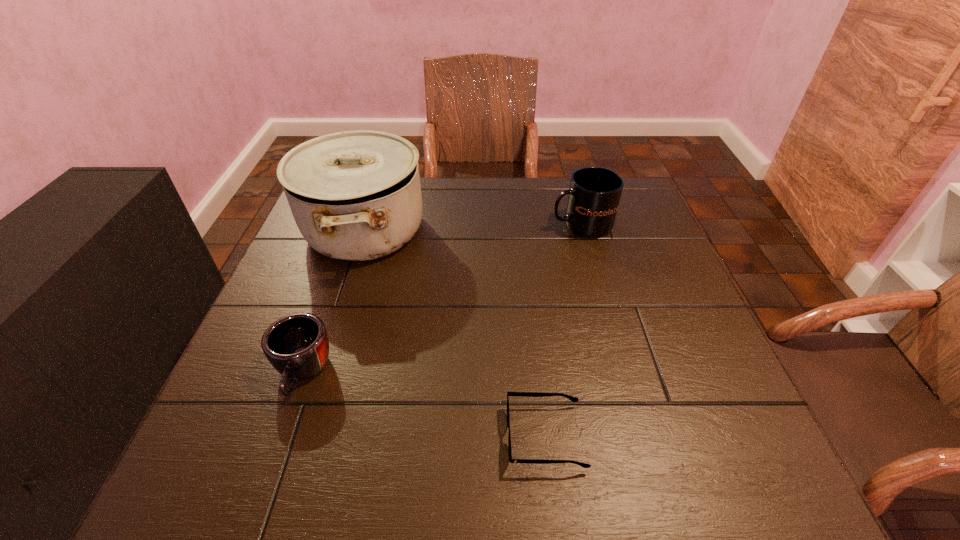
You are a GUI agent. You are given a task and a screenshot of the screen. Output one action in this format:
    pyautogui.click(x=<x>, y=<y>)
    Task: Click on the free point between the saucepan and the shortest object
    The height and width of the screenshot is (540, 960).
    Given the screenshot: What is the action you would take?
    pyautogui.click(x=455, y=333)

The height and width of the screenshot is (540, 960). I want to click on vacant region between the spectacles and the left mug, so click(424, 404).

Where is `unoccupied area between the rightmost object and the saucepan`? unoccupied area between the rightmost object and the saucepan is located at coordinates (472, 227).

The height and width of the screenshot is (540, 960). Find the location of `free space between the spectacles and the saucepan`. free space between the spectacles and the saucepan is located at coordinates (455, 333).

Identify the location of vacant area that lies between the nearer mug and the saucepan. (334, 301).

Find the location of a particular element. vacant region between the left mug and the spectacles is located at coordinates tap(424, 404).

Where is `unoccupied area between the shortest object and the right mug`? The width and height of the screenshot is (960, 540). unoccupied area between the shortest object and the right mug is located at coordinates (564, 330).

I want to click on vacant space in between the shortest object and the rightmost object, so click(x=564, y=330).

The image size is (960, 540). In order to click on object that is the third closest one to the rightmost object in this screenshot , I will do (297, 346).

Point out which object is positioned as the nearest to the shorter mug. Please provide its 2D coordinates. Your answer should be formatted as a tuple, i.e. [(x, y)], where the tuple contains the x and y coordinates of a point satisfying the conditions above.

[(355, 195)]